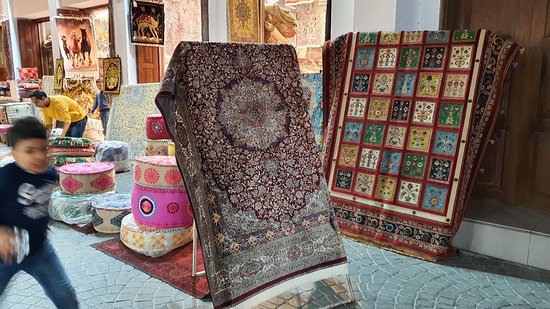
At what (x,y) coordinates should I click in order to perform the action: click on paintings. Please return your answer as a coordinate pair (x, y). This screenshot has width=550, height=309. Looking at the image, I should click on (148, 23), (78, 40).